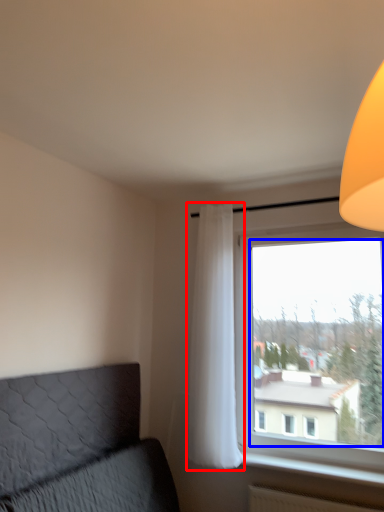
Question: Among these objects, which one is farthest to the camera, curtain (highlighted by a red box) or window screen (highlighted by a blue box)?

Choices:
 (A) curtain
 (B) window screen

Answer: (A)